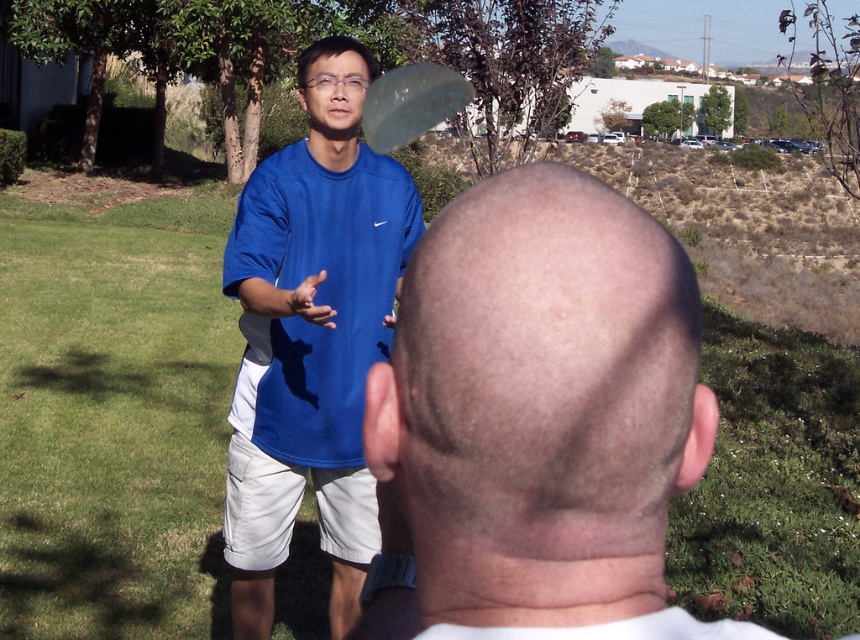
You are a photographer trying to capture a photo of the blue matte shirt at upper left and the transparent plastic frisbee at upper center. Which object should you focus on first if you want to ensure both are in focus, given that the frisbee is farther away?

The blue matte shirt at upper left is not as tall as the transparent plastic frisbee at upper center, so the frisbee is farther away. To ensure both are in focus, focus on the transparent plastic frisbee at upper center first since it is farther away.

You are standing in the grassy area and want to walk towards the point that is closer to you. Which point should you head towards, point (435, 244) or point (397, 120)?

You should head towards point (435, 244) because it is closer to the viewer than point (397, 120).